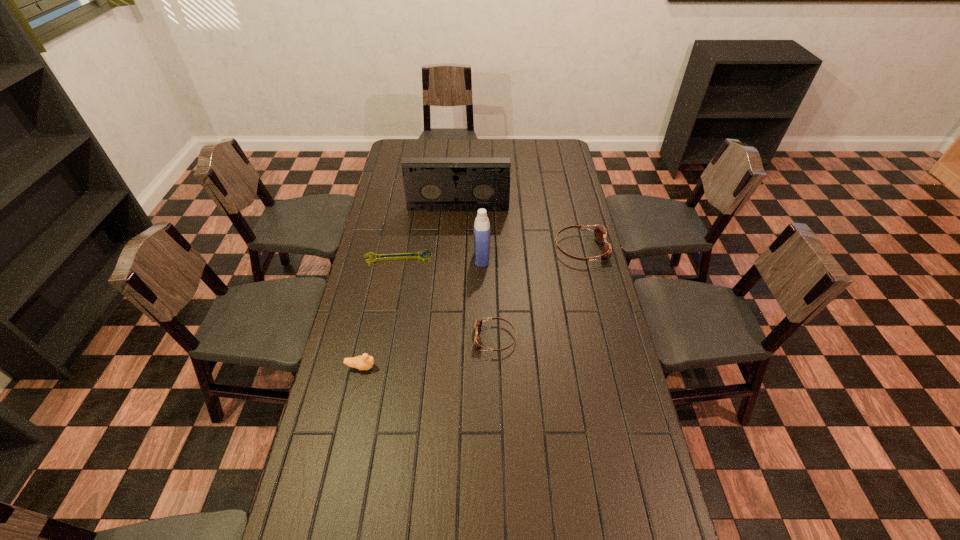
The height and width of the screenshot is (540, 960). What are the coordinates of `the fifth farthest object` in the screenshot? It's located at (477, 324).

The width and height of the screenshot is (960, 540). I want to click on the nearer goggles, so click(x=477, y=324).

You are a GUI agent. You are given a task and a screenshot of the screen. Output one action in this format:
    pyautogui.click(x=<x>, y=<y>)
    Task: Click on the rightmost object
    This screenshot has width=960, height=540.
    Given the screenshot: What is the action you would take?
    pyautogui.click(x=600, y=234)

Locate an element on the screen. the farther goggles is located at coordinates (600, 234).

Locate an element on the screen. This screenshot has width=960, height=540. detergent is located at coordinates (482, 228).

Where is `the farthest object`? The image size is (960, 540). the farthest object is located at coordinates (431, 184).

The height and width of the screenshot is (540, 960). What are the coordinates of `wrench` in the screenshot? It's located at (402, 255).

The image size is (960, 540). In order to click on the nearest object in this screenshot , I will do `click(365, 362)`.

The width and height of the screenshot is (960, 540). Find the location of `vacant space situated through the lenses of the second nearest object`. vacant space situated through the lenses of the second nearest object is located at coordinates (384, 338).

The image size is (960, 540). I want to click on free space located through the lenses of the second nearest object, so click(447, 338).